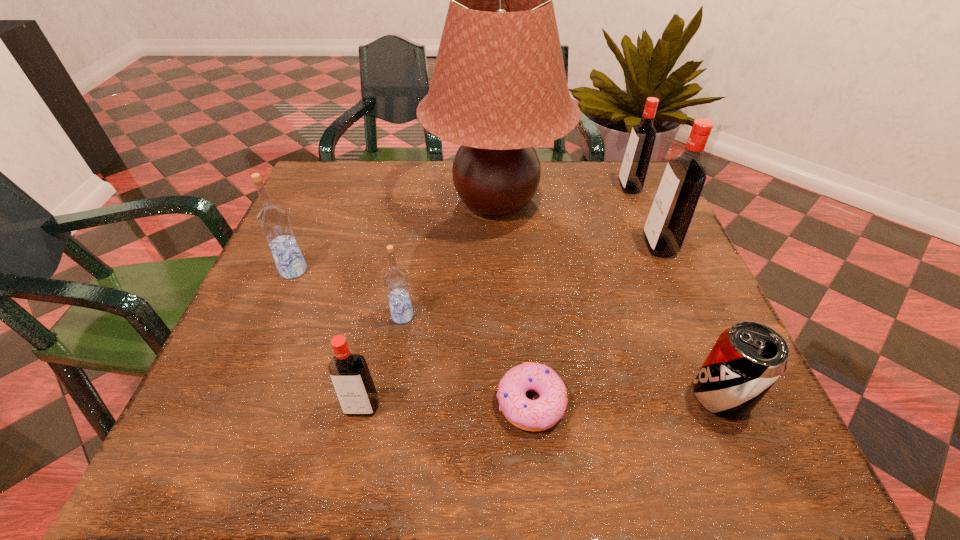
This screenshot has height=540, width=960. What are the coordinates of `free area in between the farthest red vodka and the leftmost red vodka` in the screenshot? It's located at (495, 297).

The width and height of the screenshot is (960, 540). What are the coordinates of `empty location between the smallest red vodka and the seventh shortest object` in the screenshot? It's located at (511, 327).

The width and height of the screenshot is (960, 540). I want to click on vacant area between the farther blue vodka and the nearest red vodka, so click(x=327, y=339).

Locate an element on the screen. the seventh closest object relative to the tallest object is located at coordinates (351, 378).

In order to click on object that is the fourth closest to the nearest vodka in this screenshot , I will do `click(499, 88)`.

Identify which vodka is located as the fourth nearest to the third farthest vodka. Please provide its 2D coordinates. Your answer should be formatted as a tuple, i.e. [(x, y)], where the tuple contains the x and y coordinates of a point satisfying the conditions above.

[(635, 164)]

Point out which vodka is positioned as the third nearest to the second biggest red vodka. Please provide its 2D coordinates. Your answer should be formatted as a tuple, i.e. [(x, y)], where the tuple contains the x and y coordinates of a point satisfying the conditions above.

[(274, 222)]

You are a GUI agent. You are given a task and a screenshot of the screen. Output one action in this format:
    pyautogui.click(x=<x>, y=<y>)
    Task: Click on the third closest red vodka relative to the tallest object
    The image size is (960, 540).
    Given the screenshot: What is the action you would take?
    pyautogui.click(x=351, y=378)

Locate which red vodka is the second closest to the brown lampshade. Please provide its 2D coordinates. Your answer should be formatted as a tuple, i.e. [(x, y)], where the tuple contains the x and y coordinates of a point satisfying the conditions above.

[(679, 191)]

Find the location of a particular element. The image size is (960, 540). free region that satisfies the following two spatial constraints: 1. on the front and back of the farthest red vodka; 2. on the front and back of the nearest vodka is located at coordinates (723, 407).